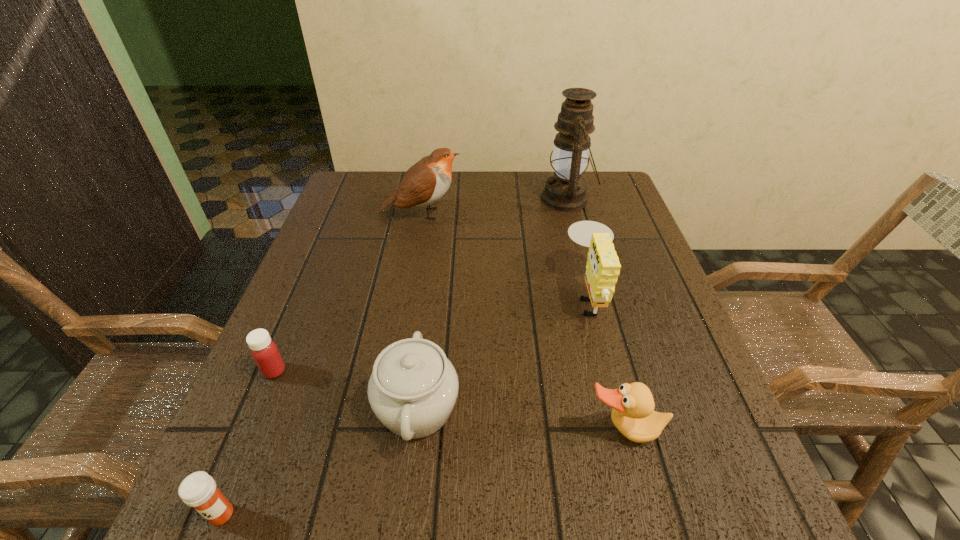
Identify the location of the tallest object. The width and height of the screenshot is (960, 540). (565, 191).

Find the location of a particular element. This screenshot has width=960, height=540. bird is located at coordinates (427, 181).

Identify the location of sponge. The height and width of the screenshot is (540, 960). (603, 268).

The image size is (960, 540). In order to click on the third farthest object in this screenshot , I will do `click(603, 268)`.

The image size is (960, 540). I want to click on chinaware, so click(x=413, y=388).

Where is `duck`? The height and width of the screenshot is (540, 960). duck is located at coordinates (633, 414).

Locate an element on the screen. This screenshot has width=960, height=540. the farther medicine is located at coordinates (264, 351).

Where is `the nearest object`? This screenshot has width=960, height=540. the nearest object is located at coordinates (198, 490).

Locate an element on the screen. free space located 0.050m on the back of the oil lamp is located at coordinates (560, 173).

Where is `free space located 0.160m at the face of the bird`? free space located 0.160m at the face of the bird is located at coordinates (522, 213).